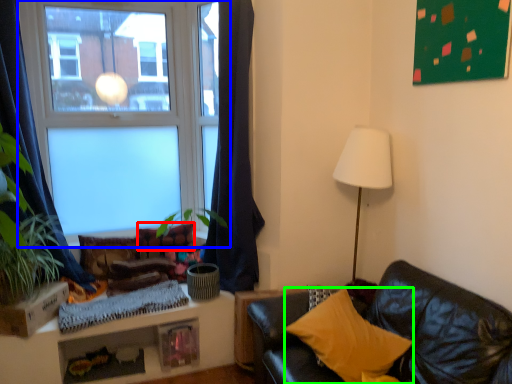
Question: Considering the real-world distances, which object is farthest from pillow (highlighted by a red box)? window (highlighted by a blue box) or pillow (highlighted by a green box)?

Choices:
 (A) window
 (B) pillow

Answer: (B)